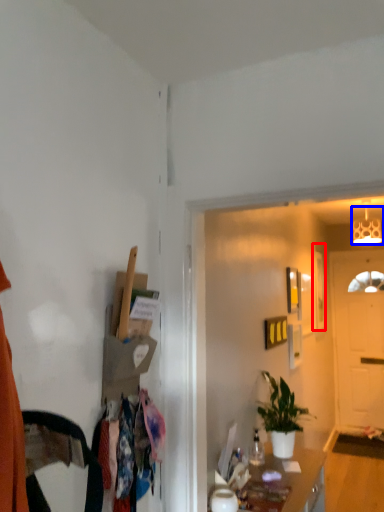
Question: Which object appears farthest to the camera in this image, picture frame (highlighted by a red box) or lamp (highlighted by a blue box)?

Choices:
 (A) picture frame
 (B) lamp

Answer: (A)